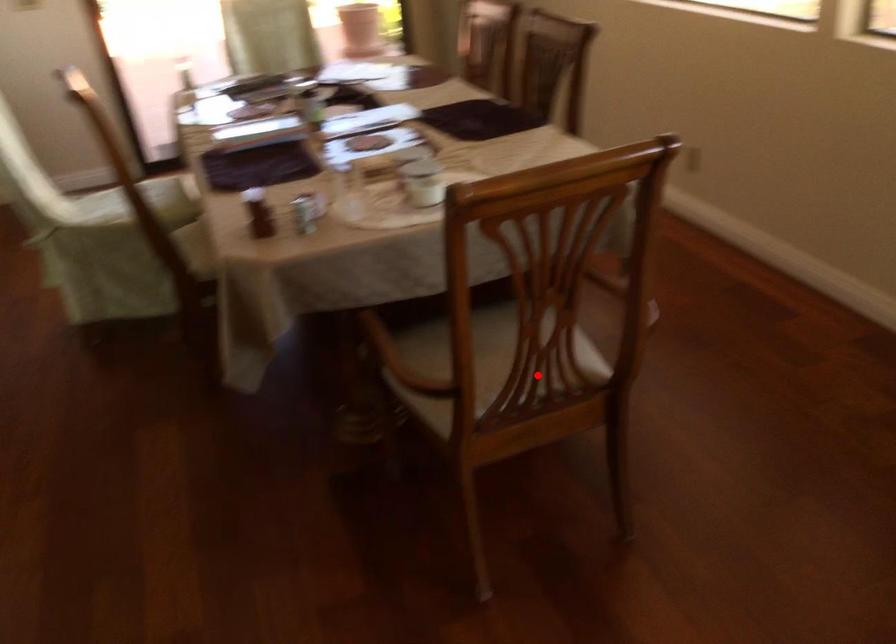
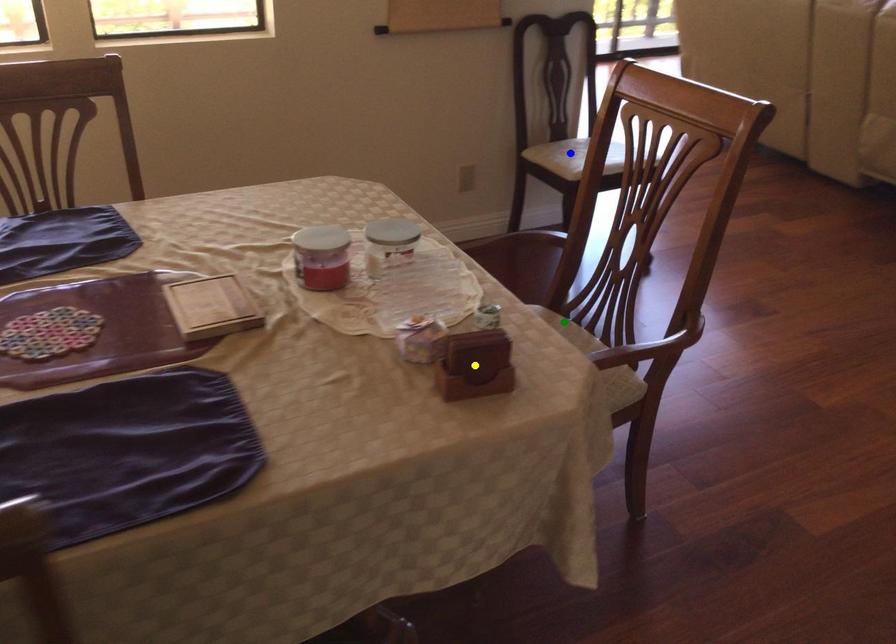
Question: I am providing you with two images of the same scene from different viewpoints. A red point is marked on the first image. You are given multiple points on the second image. Which point in image 2 is actually the same real-world point as the red point in image 1?

Choices:
 (A) yellow point
 (B) green point
 (C) blue point

Answer: (B)